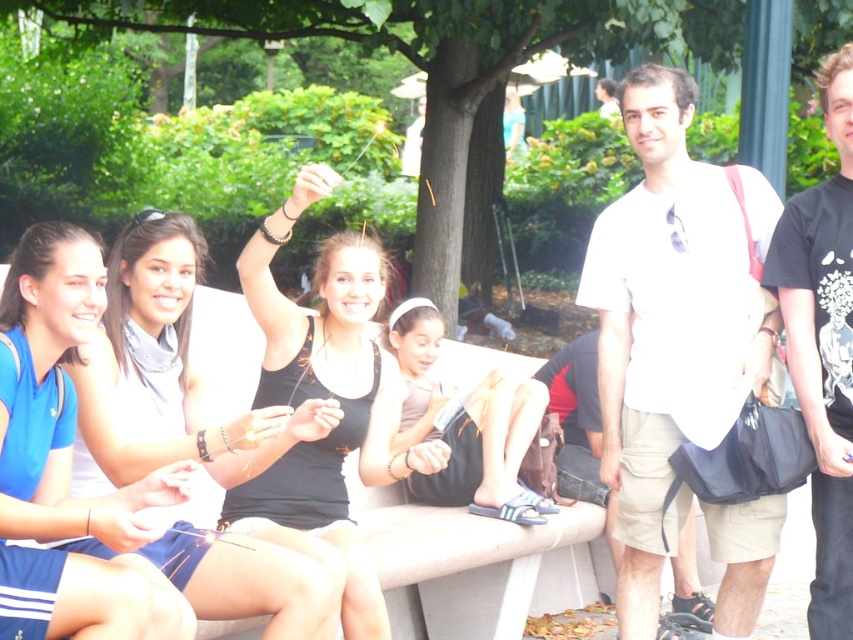
You are a photographer trying to capture a clear shot of both the white cotton shirt at center and the white cotton shirt at upper center. Since they are both white, you want to ensure they are distinguishable in the photo. Based on their positions, which one is closer to the camera?

The white cotton shirt at center is positioned under the white cotton shirt at upper center, meaning it is closer to the camera. This placement will help differentiate them in the photo as the lower shirt will appear larger and more prominent.